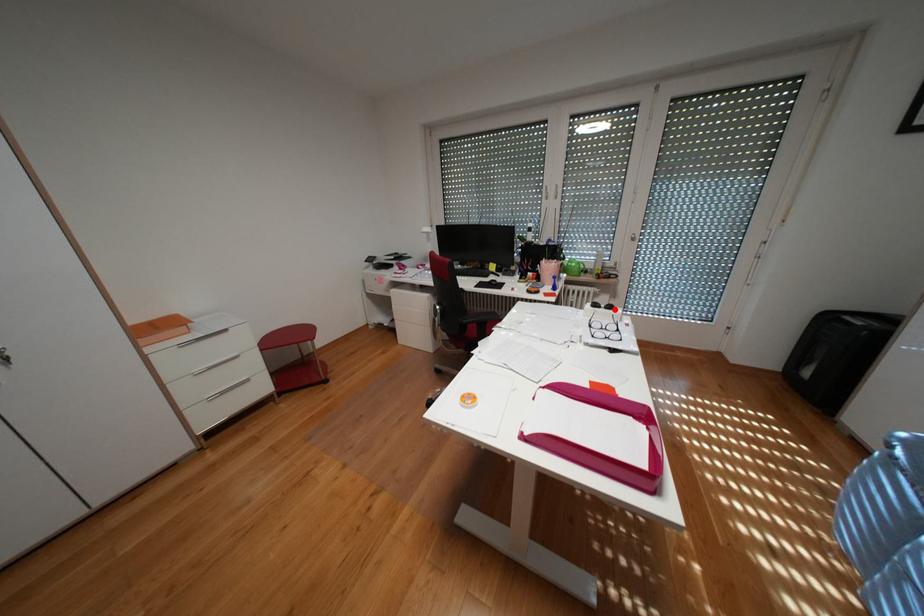
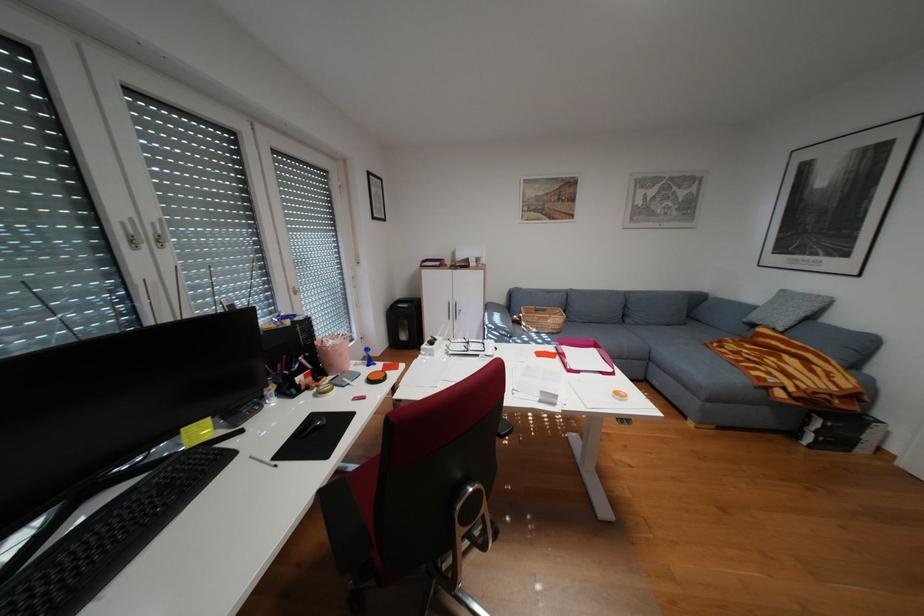
Where in the second image is the point corresponding to the highlighted location from the first image?

(448, 342)